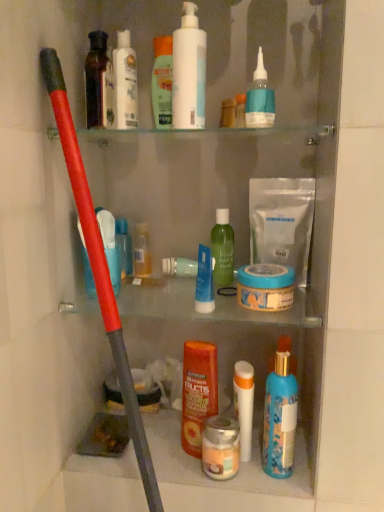
Describe the element at coordinates (99, 83) in the screenshot. The image size is (384, 512). I see `matte black bottle at upper left, the 10th toiletry positioned from the right` at that location.

The image size is (384, 512). Identify the location of orange glossy shampoo at center, the sixth toiletry viewed from the right. (198, 393).

The height and width of the screenshot is (512, 384). Describe the element at coordinates (260, 98) in the screenshot. I see `blue matte bottle at upper center, the 10th toiletry in the left-to-right sequence` at that location.

Where is `blue glossy spray bottle at lower center, which is the first toiletry in right-to-left order`? This screenshot has width=384, height=512. blue glossy spray bottle at lower center, which is the first toiletry in right-to-left order is located at coordinates (280, 415).

At what (x,y) coordinates should I click in order to perform the action: click on green matte lotion at upper center, arranged as the 7th toiletry when viewed from the right. Please return your answer as a coordinate pair (x, y). Looking at the image, I should click on (162, 82).

I want to click on translucent plastic bottle at center, arranged as the eighth toiletry when viewed from the right, so click(141, 252).

Is metallic silver jar at center, the fifth toiletry in the right-to-left sequence, not close to blue glossy spray bottle at lower center, which is the first toiletry in right-to-left order?

No.

Considering the relative sizes of metallic silver jar at center, the 7th toiletry when ordered from left to right, and blue glossy spray bottle at lower center, arranged as the 11th toiletry when viewed from the left, in the image provided, is metallic silver jar at center, the 7th toiletry when ordered from left to right, thinner than blue glossy spray bottle at lower center, arranged as the 11th toiletry when viewed from the left,?

No.

Is point (226, 463) positioned after point (293, 416)?

No, (226, 463) is in front of (293, 416).

You are a GUI agent. You are given a task and a screenshot of the screen. Output one action in this format:
    pyautogui.click(x=<x>, y=<y>)
    Task: Click on the 3rd toiletry positioned below the blue glossy spray bottle at lower center, which is the first toiletry in right-to-left order (from a real-world perspective)
    
    Given the screenshot: What is the action you would take?
    pyautogui.click(x=220, y=447)

Could you tell me if green matte lotion at upper center, arranged as the 7th toiletry when viewed from the right, is turned towards metallic silver jar at center, the fifth toiletry in the right-to-left sequence?

No, green matte lotion at upper center, arranged as the 7th toiletry when viewed from the right, is not facing towards metallic silver jar at center, the fifth toiletry in the right-to-left sequence.

Would you consider green matte lotion at upper center, which is the fifth toiletry in left-to-right order, to be distant from metallic silver jar at center, the fifth toiletry in the right-to-left sequence?

No, green matte lotion at upper center, which is the fifth toiletry in left-to-right order, is not far away from metallic silver jar at center, the fifth toiletry in the right-to-left sequence.

Can you tell me how much green matte lotion at upper center, which is the fifth toiletry in left-to-right order, and metallic silver jar at center, the fifth toiletry in the right-to-left sequence, differ in facing direction?

There is a 11.4-degree angle between the facing directions of green matte lotion at upper center, which is the fifth toiletry in left-to-right order, and metallic silver jar at center, the fifth toiletry in the right-to-left sequence.

Could you tell me if white matte tube at center, which ranks as the ninth toiletry in left-to-right order, is turned towards translucent plastic bottle at left, arranged as the eleventh toiletry when viewed from the right?

No, white matte tube at center, which ranks as the ninth toiletry in left-to-right order, is not oriented towards translucent plastic bottle at left, arranged as the eleventh toiletry when viewed from the right.

You are a GUI agent. You are given a task and a screenshot of the screen. Output one action in this format:
    pyautogui.click(x=<x>, y=<y>)
    Task: Click on the 5th toiletry positioned below the translucent plastic bottle at left, marked as the 1th toiletry in a left-to-right arrangement (from the image's perspective)
    This screenshot has width=384, height=512.
    Given the screenshot: What is the action you would take?
    pyautogui.click(x=244, y=405)

Which is more to the right, white matte tube at center, which ranks as the ninth toiletry in left-to-right order, or translucent plastic bottle at left, marked as the 1th toiletry in a left-to-right arrangement?

From the viewer's perspective, white matte tube at center, which ranks as the ninth toiletry in left-to-right order, appears more on the right side.

From a real-world perspective, is white matte tube at center, which appears as the third toiletry when viewed from the right, under translucent plastic bottle at left, marked as the 1th toiletry in a left-to-right arrangement?

Yes.

Which of these two, matte black bottle at upper left, the 10th toiletry positioned from the right, or green matte bottle at center, which is counted as the 4th toiletry, starting from the right, is bigger?

green matte bottle at center, which is counted as the 4th toiletry, starting from the right.

Starting from the green matte bottle at center, the 8th toiletry positioned from the left, which toiletry is the 6th one to the left? Please provide its 2D coordinates.

[(99, 83)]

Do you think matte black bottle at upper left, the 10th toiletry positioned from the right, is within green matte bottle at center, the 8th toiletry positioned from the left, or outside of it?

matte black bottle at upper left, the 10th toiletry positioned from the right, is outside green matte bottle at center, the 8th toiletry positioned from the left.

Does matte black bottle at upper left, the 10th toiletry positioned from the right, appear on the right side of green matte bottle at center, which is counted as the 4th toiletry, starting from the right?

In fact, matte black bottle at upper left, the 10th toiletry positioned from the right, is to the left of green matte bottle at center, which is counted as the 4th toiletry, starting from the right.

Would you say blue matte bottle at upper center, the 10th toiletry in the left-to-right sequence, is outside white matte pump bottle at upper center?

Yes, blue matte bottle at upper center, the 10th toiletry in the left-to-right sequence, is not within white matte pump bottle at upper center.

Is blue matte bottle at upper center, which is the 2th toiletry in right-to-left order, aimed at white matte pump bottle at upper center?

No, blue matte bottle at upper center, which is the 2th toiletry in right-to-left order, is not facing towards white matte pump bottle at upper center.

Which is behind, point (258, 127) or point (197, 20)?

The point (197, 20) is farther.

Considering the sizes of objects blue matte bottle at upper center, which is the 2th toiletry in right-to-left order, and white matte pump bottle at upper center in the image provided, who is taller, blue matte bottle at upper center, which is the 2th toiletry in right-to-left order, or white matte pump bottle at upper center?

white matte pump bottle at upper center is taller.

Between green matte lotion at upper center, arranged as the 7th toiletry when viewed from the right, and green matte bottle at center, the 8th toiletry positioned from the left, which one has smaller size?

With smaller size is green matte bottle at center, the 8th toiletry positioned from the left.

From the image's perspective, does green matte lotion at upper center, which is the fifth toiletry in left-to-right order, appear lower than green matte bottle at center, which is counted as the 4th toiletry, starting from the right?

No, from the image's perspective, green matte lotion at upper center, which is the fifth toiletry in left-to-right order, is not beneath green matte bottle at center, which is counted as the 4th toiletry, starting from the right.

Is green matte lotion at upper center, arranged as the 7th toiletry when viewed from the right, inside or outside of green matte bottle at center, which is counted as the 4th toiletry, starting from the right?

green matte lotion at upper center, arranged as the 7th toiletry when viewed from the right, exists outside the volume of green matte bottle at center, which is counted as the 4th toiletry, starting from the right.

From a real-world perspective, is green matte lotion at upper center, arranged as the 7th toiletry when viewed from the right, located beneath green matte bottle at center, the 8th toiletry positioned from the left?

No.

From the image's perspective, is white glossy lotion at upper center, which appears as the ninth toiletry when viewed from the right, over orange glossy shampoo at center, positioned as the sixth toiletry in left-to-right order?

Yes.

This screenshot has height=512, width=384. In order to click on the 8th toiletry below the white glossy lotion at upper center, which is the 3th toiletry from left to right (from a real-world perspective) in this screenshot , I will do `click(198, 393)`.

From a real-world perspective, is white glossy lotion at upper center, which is the 3th toiletry from left to right, positioned above or below orange glossy shampoo at center, positioned as the sixth toiletry in left-to-right order?

In terms of real-world spatial position, white glossy lotion at upper center, which is the 3th toiletry from left to right, is above orange glossy shampoo at center, positioned as the sixth toiletry in left-to-right order.

From the picture: Visually, is white glossy lotion at upper center, which is the 3th toiletry from left to right, positioned to the left or to the right of orange glossy shampoo at center, positioned as the sixth toiletry in left-to-right order?

Clearly, white glossy lotion at upper center, which is the 3th toiletry from left to right, is on the left of orange glossy shampoo at center, positioned as the sixth toiletry in left-to-right order, in the image.

Identify the location of the 3rd toiletry located beneath the blue glossy spray bottle at lower center, which is the first toiletry in right-to-left order (from a real-world perspective). (220, 447).

This screenshot has width=384, height=512. Find the location of `the 5th toiletry in front when counting from the green matte lotion at upper center, which is the fifth toiletry in left-to-right order`. the 5th toiletry in front when counting from the green matte lotion at upper center, which is the fifth toiletry in left-to-right order is located at coordinates (220, 447).

Based on the photo, considering their positions, is translucent plastic bottle at left, marked as the 1th toiletry in a left-to-right arrangement, positioned closer to green matte bottle at center, which is counted as the 4th toiletry, starting from the right, than translucent plastic bottle at center, positioned as the 4th toiletry in left-to-right order?

Based on the image, translucent plastic bottle at center, positioned as the 4th toiletry in left-to-right order, appears to be nearer to green matte bottle at center, which is counted as the 4th toiletry, starting from the right.

Based on their spatial positions, is metallic silver jar at center, the 7th toiletry when ordered from left to right, or translucent plastic bottle at center, arranged as the eighth toiletry when viewed from the right, further from blue glossy spray bottle at lower center, arranged as the 11th toiletry when viewed from the left?

The object further to blue glossy spray bottle at lower center, arranged as the 11th toiletry when viewed from the left, is translucent plastic bottle at center, arranged as the eighth toiletry when viewed from the right.

Based on their spatial positions, is orange glossy shampoo at center, positioned as the sixth toiletry in left-to-right order, or translucent plastic bottle at center, positioned as the 4th toiletry in left-to-right order, closer to metallic silver jar at center, the 7th toiletry when ordered from left to right?

Based on the image, orange glossy shampoo at center, positioned as the sixth toiletry in left-to-right order, appears to be nearer to metallic silver jar at center, the 7th toiletry when ordered from left to right.

Considering their positions, is blue matte bottle at upper center, the 10th toiletry in the left-to-right sequence, positioned closer to white glossy lotion at upper center, which appears as the ninth toiletry when viewed from the right, than green matte lotion at upper center, which is the fifth toiletry in left-to-right order?

Based on the image, green matte lotion at upper center, which is the fifth toiletry in left-to-right order, appears to be nearer to white glossy lotion at upper center, which appears as the ninth toiletry when viewed from the right.

Estimate the real-world distances between objects in this image. Which object is closer to blue glossy spray bottle at lower center, which is the first toiletry in right-to-left order, translucent plastic bottle at left, arranged as the eleventh toiletry when viewed from the right, or matte black bottle at upper left, the 10th toiletry positioned from the right?

Among the two, translucent plastic bottle at left, arranged as the eleventh toiletry when viewed from the right, is located nearer to blue glossy spray bottle at lower center, which is the first toiletry in right-to-left order.

From the image, which object appears to be nearer to orange glossy shampoo at center, the sixth toiletry viewed from the right, white matte tube at center, which appears as the third toiletry when viewed from the right, or green matte bottle at center, the 8th toiletry positioned from the left?

white matte tube at center, which appears as the third toiletry when viewed from the right, is positioned closer to the anchor orange glossy shampoo at center, the sixth toiletry viewed from the right.

Based on their spatial positions, is blue matte bottle at upper center, which is the 2th toiletry in right-to-left order, or orange glossy shampoo at center, the sixth toiletry viewed from the right, further from blue glossy spray bottle at lower center, which is the first toiletry in right-to-left order?

Among the two, blue matte bottle at upper center, which is the 2th toiletry in right-to-left order, is located further to blue glossy spray bottle at lower center, which is the first toiletry in right-to-left order.

From the image, which object appears to be farther from metallic silver jar at center, the fifth toiletry in the right-to-left sequence, white matte pump bottle at upper center or translucent plastic bottle at center, positioned as the 4th toiletry in left-to-right order?

The object further to metallic silver jar at center, the fifth toiletry in the right-to-left sequence, is white matte pump bottle at upper center.

What are the coordinates of `cleaning product that lies between green matte lotion at upper center, which is the fifth toiletry in left-to-right order, and metallic silver jar at center, the 7th toiletry when ordered from left to right, from top to bottom` in the screenshot? It's located at (189, 71).

Locate an element on the screen. cleaning product situated between white glossy lotion at upper center, which is the 3th toiletry from left to right, and blue matte bottle at upper center, which is the 2th toiletry in right-to-left order, from left to right is located at coordinates (189, 71).

This screenshot has height=512, width=384. Find the location of `mouthwash between matte black bottle at upper left, the 10th toiletry positioned from the right, and white matte tube at center, which ranks as the ninth toiletry in left-to-right order, vertically`. mouthwash between matte black bottle at upper left, the 10th toiletry positioned from the right, and white matte tube at center, which ranks as the ninth toiletry in left-to-right order, vertically is located at coordinates (265, 287).

Find the location of a particular element. The width and height of the screenshot is (384, 512). cleaning product that lies between white glossy lotion at upper center, which appears as the ninth toiletry when viewed from the right, and green matte bottle at center, which is counted as the 4th toiletry, starting from the right, from top to bottom is located at coordinates (189, 71).